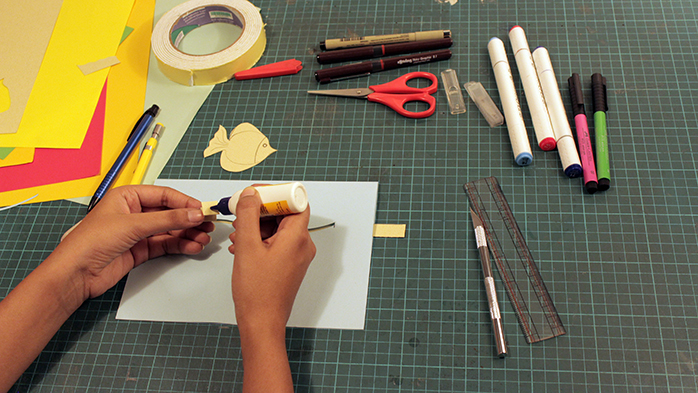
Identify the location of marker. click(519, 142), click(540, 123), click(565, 127), click(588, 138), click(602, 138), click(392, 62), click(392, 52), click(392, 36).